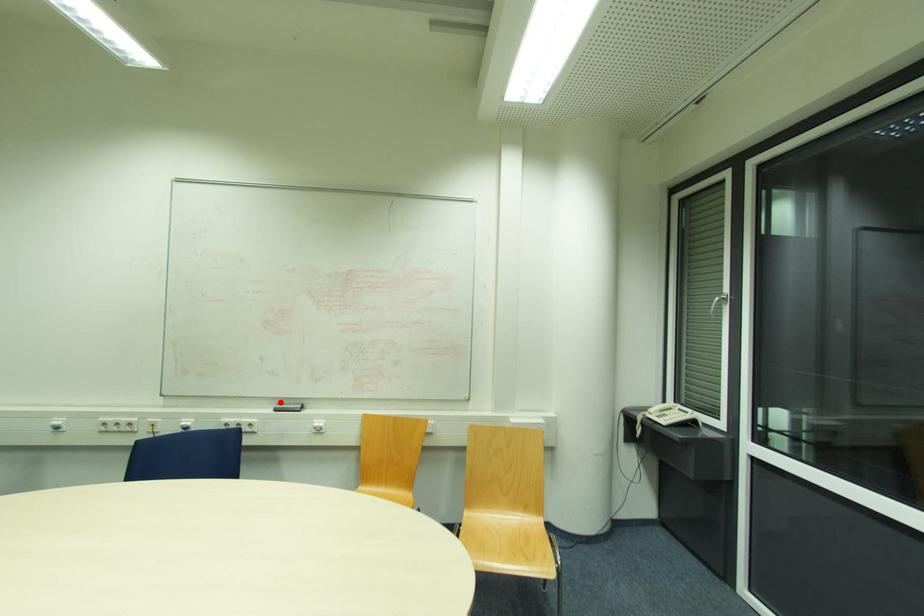
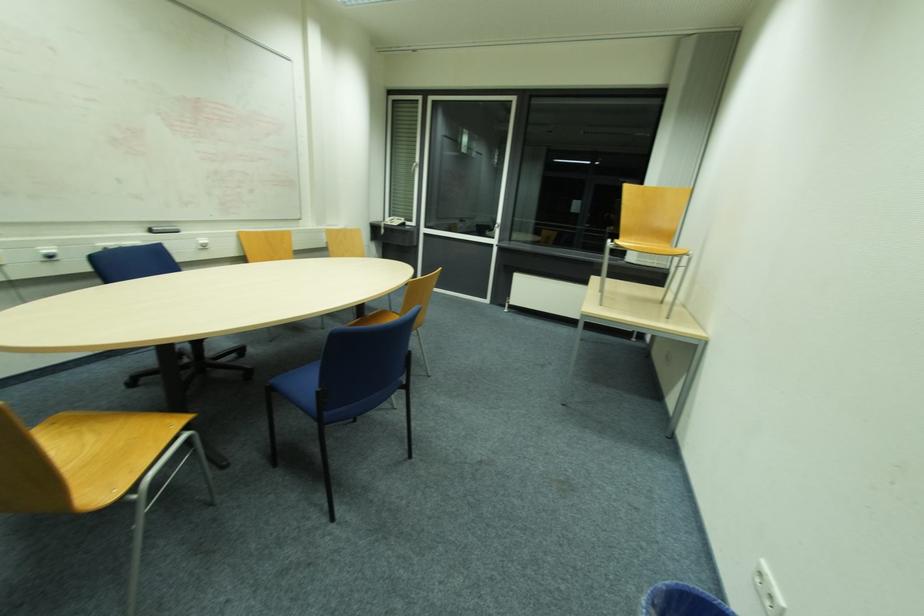
In the second image, find the point that corresponds to the highlighted location in the first image.

(151, 227)